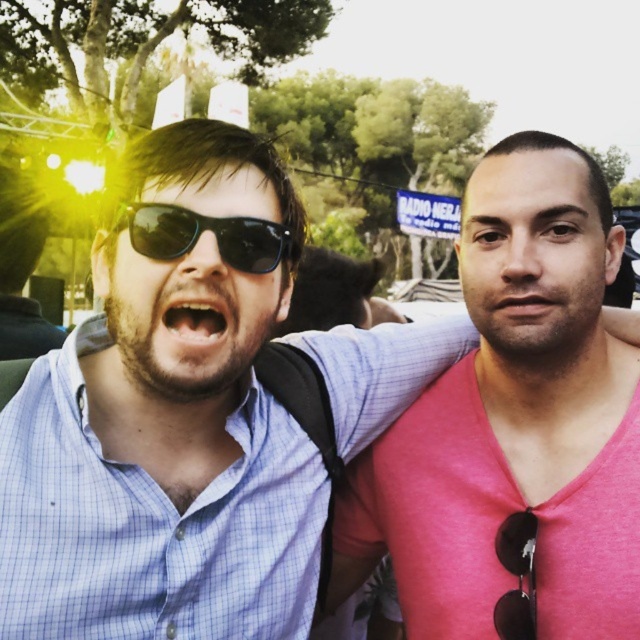
You are a photographer trying to capture a closeup shot of the matte black sunglasses at center and the pink matte skin at center in the image. Which object should you zoom in on to ensure it fills the frame more without moving the camera?

The matte black sunglasses at center has a greater height compared to pink matte skin at center, so you should zoom in on the matte black sunglasses at center to ensure it fills the frame more without moving the camera.